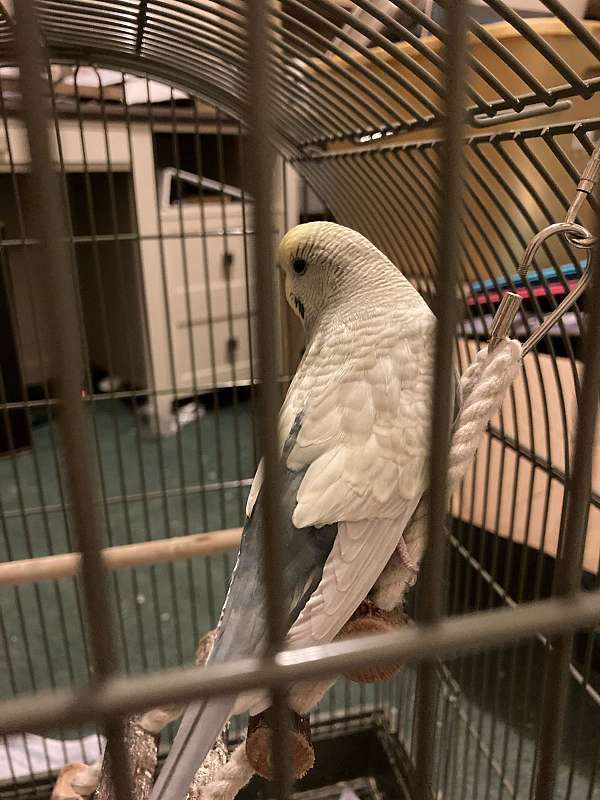
Locate an element on the screen. This screenshot has width=600, height=800. wooden stepladder is located at coordinates (382, 670), (300, 745), (220, 749), (145, 754).